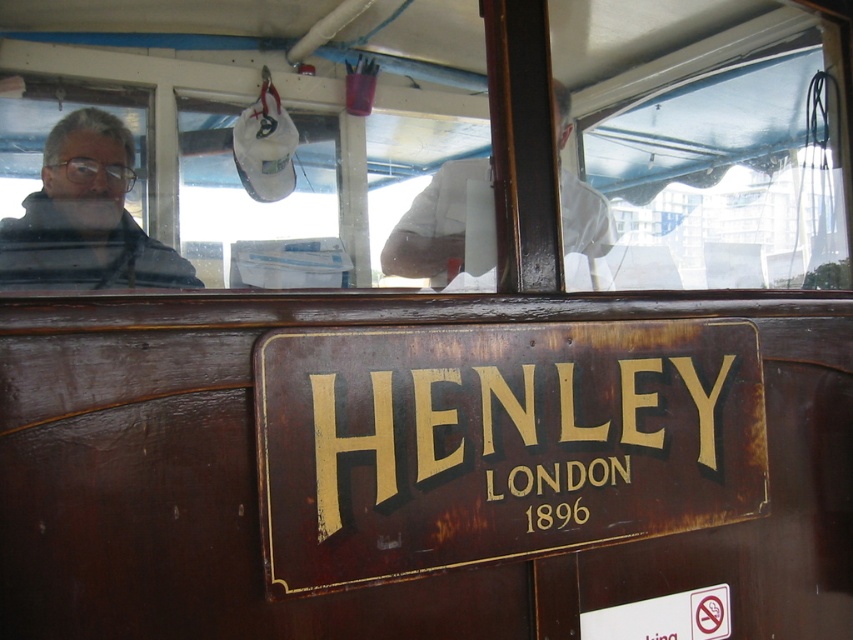
Which is more to the right, transparent glass window at center or rusty metal sign at center?

transparent glass window at center is more to the right.

The width and height of the screenshot is (853, 640). I want to click on transparent glass window at center, so click(x=292, y=120).

Who is positioned more to the left, rusty metal sign at center or gray matte jacket at left?

From the viewer's perspective, gray matte jacket at left appears more on the left side.

Can you confirm if rusty metal sign at center is bigger than gray matte jacket at left?

Actually, rusty metal sign at center might be smaller than gray matte jacket at left.

Which is in front, point (381, 376) or point (183, 284)?

Point (381, 376) is in front.

Where is `rusty metal sign at center`? The image size is (853, 640). rusty metal sign at center is located at coordinates (498, 442).

Is point (712, 172) closer to viewer compared to point (70, 157)?

No.

Who is shorter, transparent glass window at center or gray matte jacket at left?

With less height is gray matte jacket at left.

Between point (639, 253) and point (99, 186), which one is positioned in front?

Positioned in front is point (639, 253).

Where is `transparent glass window at center`? This screenshot has height=640, width=853. transparent glass window at center is located at coordinates (292, 120).